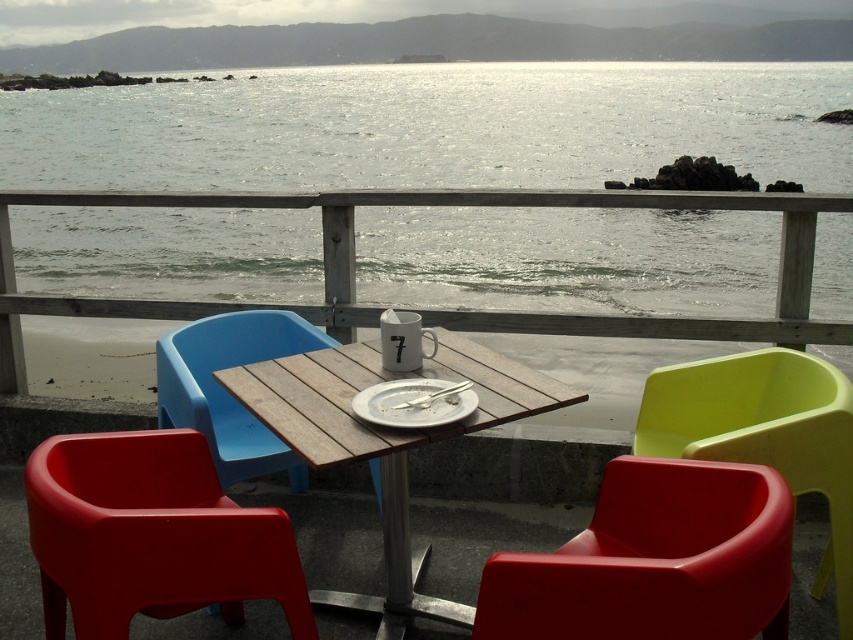
Question: Is matte plastic chair at lower right thinner than matte plastic chair at lower left?

Choices:
 (A) no
 (B) yes

Answer: (B)

Question: Which of the following is the farthest from the observer?

Choices:
 (A) lime green plastic chair at right
 (B) matte plastic chair at lower right
 (C) matte plastic chair at lower left
 (D) wooden table at center

Answer: (A)

Question: Can you confirm if wooden at center is positioned above lime green plastic chair at right?

Choices:
 (A) no
 (B) yes

Answer: (B)

Question: Which point is closer to the camera taking this photo?

Choices:
 (A) (527, 584)
 (B) (451, 385)
 (C) (231, 577)

Answer: (A)

Question: Considering the real-world distances, which object is closest to the blue plastic chair at center?

Choices:
 (A) glistening water at table center
 (B) wooden at center
 (C) matte plastic chair at lower right
 (D) lime green plastic chair at right

Answer: (B)

Question: In this image, where is glistening water at table center located relative to matte plastic chair at lower right?

Choices:
 (A) right
 (B) left

Answer: (B)